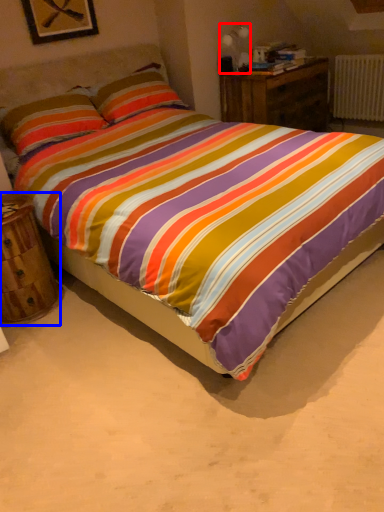
Question: Which of the following is the closest to the observer, table lamp (highlighted by a red box) or nightstand (highlighted by a blue box)?

Choices:
 (A) table lamp
 (B) nightstand

Answer: (B)